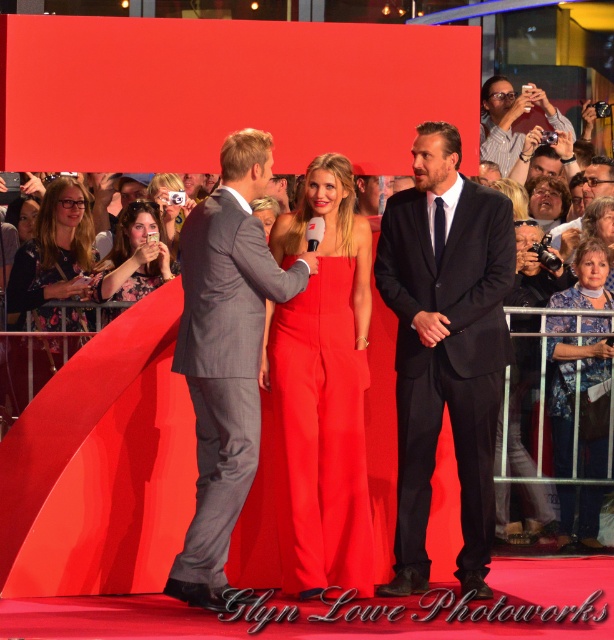
Question: Which point is closer to the camera?

Choices:
 (A) (126, 241)
 (B) (52, 326)

Answer: (B)

Question: Observing the image, what is the correct spatial positioning of matte black suit at center in reference to matte black camera at upper right?

Choices:
 (A) above
 (B) below

Answer: (B)

Question: Is floral-patterned dress at lower left smaller than matte black camera at upper right?

Choices:
 (A) yes
 (B) no

Answer: (A)

Question: Is gray pinstripe suit at center to the right of matte black camera at upper right from the viewer's perspective?

Choices:
 (A) yes
 (B) no

Answer: (B)

Question: Which point is closer to the camera taking this photo?

Choices:
 (A) (503, 152)
 (B) (359, 449)

Answer: (B)

Question: Based on their relative distances, which object is farther from the floral-patterned dress at lower left?

Choices:
 (A) matte red jumpsuit at center
 (B) matte black camera at upper right

Answer: (B)